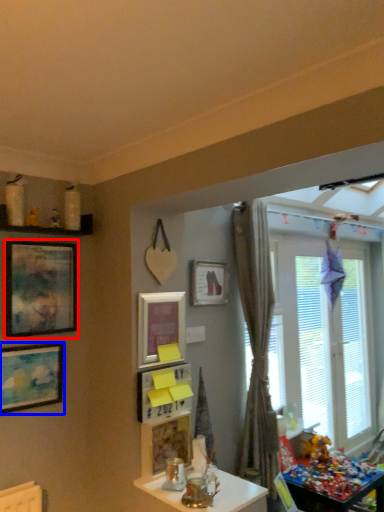
Question: Among these objects, which one is nearest to the camera, picture frame (highlighted by a red box) or picture frame (highlighted by a blue box)?

Choices:
 (A) picture frame
 (B) picture frame

Answer: (B)